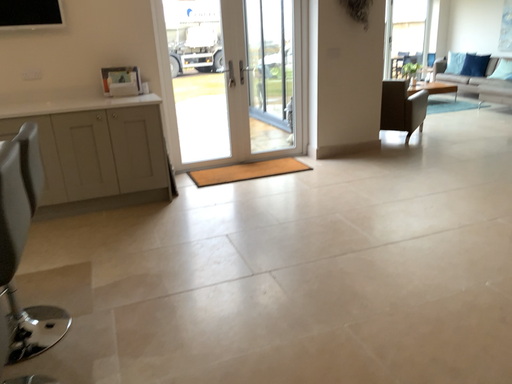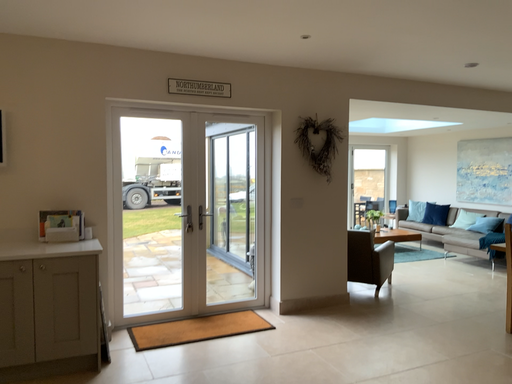
Question: How did the camera likely rotate when shooting the video?

Choices:
 (A) rotated upward
 (B) rotated downward

Answer: (A)